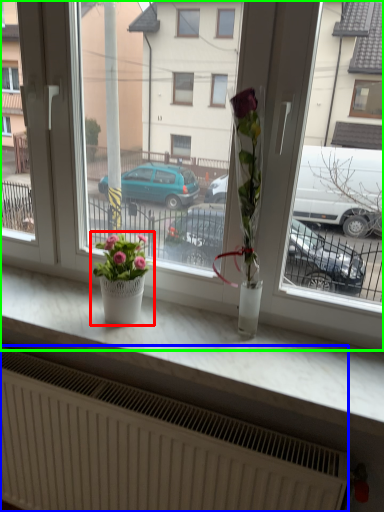
Question: Which is farther away from houseplant (highlighted by a red box)? radiator (highlighted by a blue box) or window (highlighted by a green box)?

Choices:
 (A) radiator
 (B) window

Answer: (A)